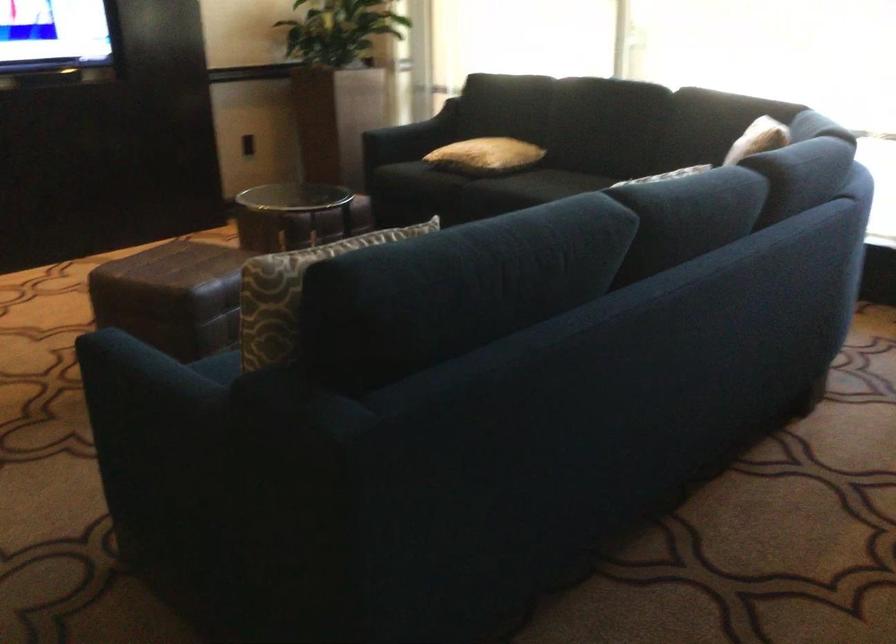
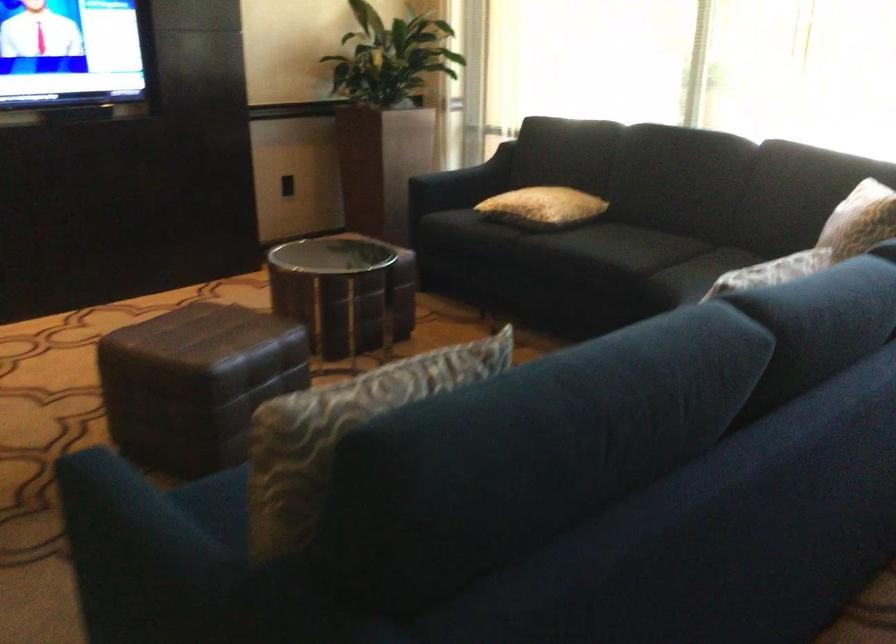
Where in the second image is the point corresponding to point (147, 379) from the first image?

(134, 534)